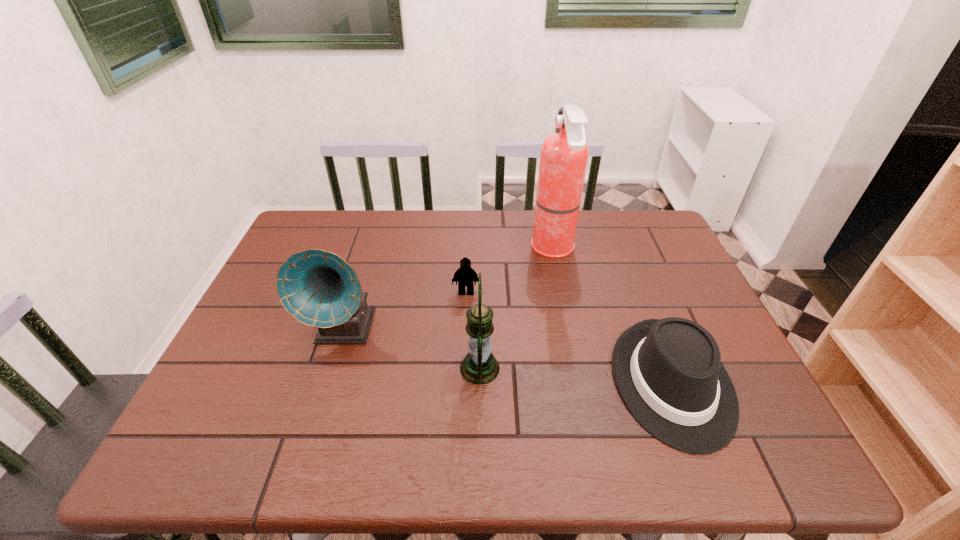
Identify the location of the tallest object. The width and height of the screenshot is (960, 540). (564, 155).

Find the location of a particular element. The width and height of the screenshot is (960, 540). the farthest object is located at coordinates (564, 155).

At what (x,y) coordinates should I click in order to perform the action: click on phonograph_record. Please return your answer as a coordinate pair (x, y). This screenshot has width=960, height=540. Looking at the image, I should click on (319, 288).

Locate an element on the screen. This screenshot has height=540, width=960. lantern is located at coordinates (479, 366).

At what (x,y) coordinates should I click in order to perform the action: click on the rightmost object. Please return your answer as a coordinate pair (x, y). This screenshot has width=960, height=540. Looking at the image, I should click on (668, 372).

Find the location of a particular element. the fourth nearest object is located at coordinates (465, 275).

Identify the location of vacant space located 0.400m with the handle and hose on the farthest object. This screenshot has width=960, height=540. (403, 248).

This screenshot has height=540, width=960. Find the location of `vacant space located 0.250m with the handle and hose on the farthest object`. vacant space located 0.250m with the handle and hose on the farthest object is located at coordinates (451, 248).

This screenshot has width=960, height=540. Find the location of `free spot located 0.180m with the handle and hose on the farthest object`. free spot located 0.180m with the handle and hose on the farthest object is located at coordinates (473, 248).

Where is `vacant area situated from the horn of the leftmost object`? The image size is (960, 540). vacant area situated from the horn of the leftmost object is located at coordinates (310, 440).